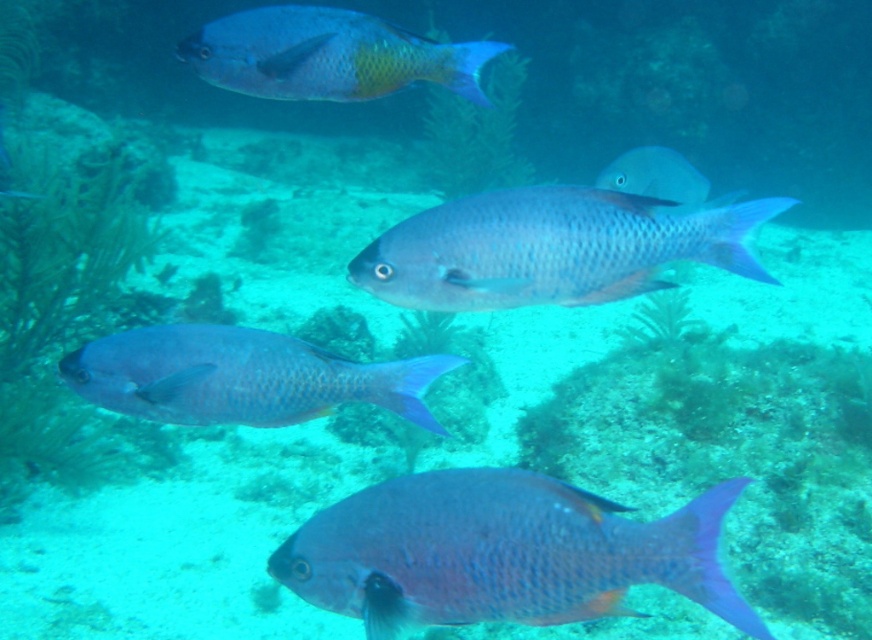
Question: Which object is the farthest from the satin blue fish at center?

Choices:
 (A) matte blue fish at center
 (B) satin blue fish at lower left
 (C) shiny blue fish at upper center

Answer: (C)

Question: Does matte blue fish at center have a smaller size compared to satin blue fish at center?

Choices:
 (A) yes
 (B) no

Answer: (B)

Question: Which object appears farthest from the camera in this image?

Choices:
 (A) satin blue fish at lower left
 (B) shiny blue fish at upper center

Answer: (B)

Question: Does matte blue fish at center have a smaller size compared to satin blue fish at lower left?

Choices:
 (A) no
 (B) yes

Answer: (A)

Question: Which object is the farthest from the satin blue fish at center?

Choices:
 (A) shiny blue fish at upper center
 (B) satin blue fish at lower left
 (C) matte blue fish at center

Answer: (A)

Question: Can you confirm if satin blue fish at center is positioned to the right of shiny blue fish at upper center?

Choices:
 (A) yes
 (B) no

Answer: (A)